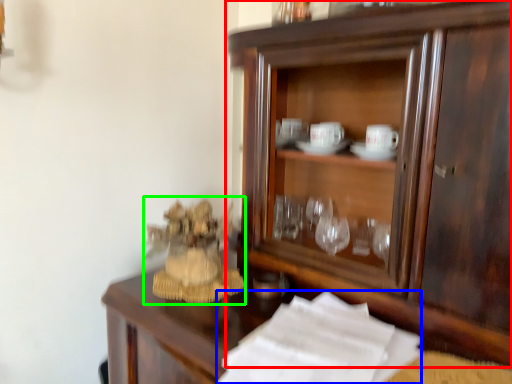
Question: Which object is positioned closest to cupboard (highlighted by a red box)? Select from paper (highlighted by a blue box) and toy (highlighted by a green box).

Choices:
 (A) paper
 (B) toy

Answer: (A)